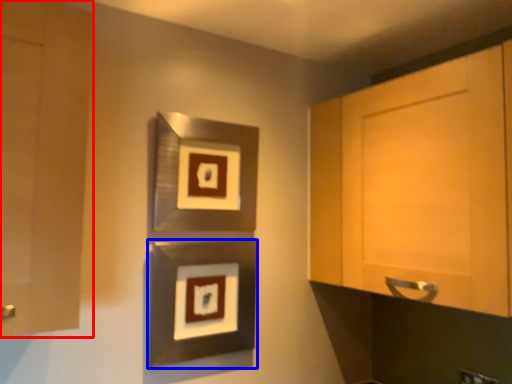
Question: Which point is further to the camera, cabinetry (highlighted by a red box) or picture frame (highlighted by a blue box)?

Choices:
 (A) cabinetry
 (B) picture frame

Answer: (B)